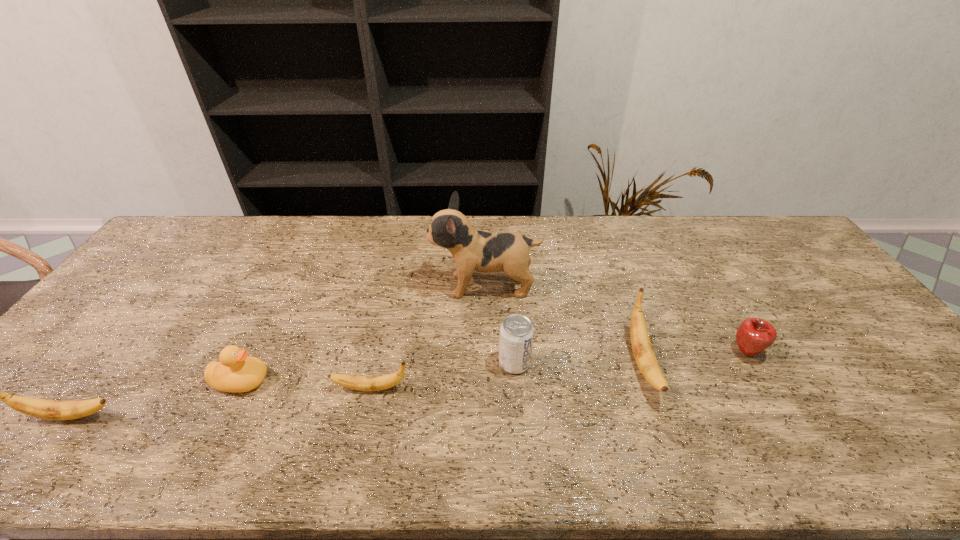
The image size is (960, 540). I want to click on free location that satisfies the following two spatial constraints: 1. on the peel of the sixth object from left to right from the top; 2. on the peel of the second shortest banana from the top, so click(660, 416).

The height and width of the screenshot is (540, 960). In order to click on vacant point that satisfies the following two spatial constraints: 1. on the front side of the rightmost object; 2. on the peel of the leftmost banana from the top in this screenshot , I will do `click(784, 416)`.

At what (x,y) coordinates should I click in order to perform the action: click on free point that satisfies the following two spatial constraints: 1. on the front side of the rightmost object; 2. on the face of the duck. Please return your answer as a coordinate pair (x, y). Looking at the image, I should click on (764, 381).